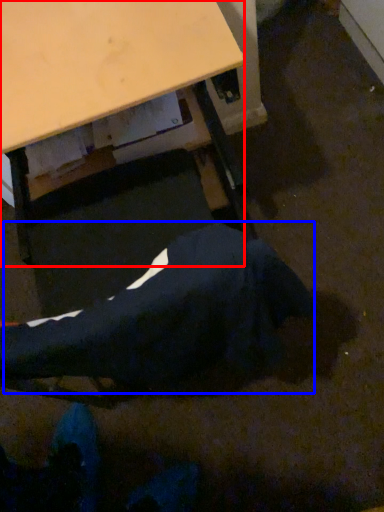
Question: Which of the following is the farthest to the observer, desk (highlighted by a red box) or robe (highlighted by a blue box)?

Choices:
 (A) desk
 (B) robe

Answer: (A)